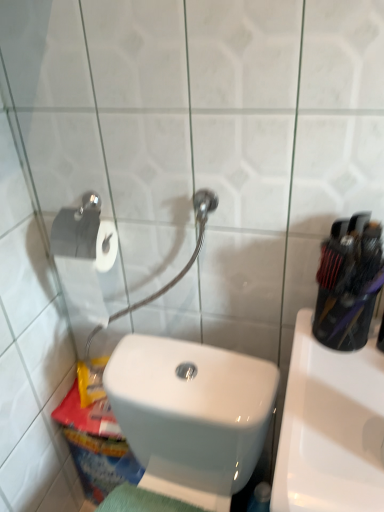
Find the location of a particular element. Image resolution: width=384 pixels, height=512 pixels. white glossy toilet at lower left is located at coordinates (191, 415).

The width and height of the screenshot is (384, 512). Describe the element at coordinates (191, 415) in the screenshot. I see `white glossy toilet at lower left` at that location.

This screenshot has width=384, height=512. What do you see at coordinates (331, 428) in the screenshot?
I see `white glossy sink at right` at bounding box center [331, 428].

Locate an element on the screen. This screenshot has height=512, width=384. white glossy sink at right is located at coordinates (331, 428).

The width and height of the screenshot is (384, 512). I want to click on white glossy toilet at lower left, so click(191, 415).

Is white glossy sink at right to the left or to the right of white glossy toilet at lower left in the image?

In the image, white glossy sink at right appears on the right side of white glossy toilet at lower left.

Between white glossy sink at right and white glossy toilet at lower left, which one is positioned in front?

white glossy toilet at lower left is more forward.

Is point (341, 461) less distant than point (238, 440)?

That is True.

Looking at this image, from the image's perspective, which is below, white glossy sink at right or white glossy toilet at lower left?

From the image's view, white glossy toilet at lower left is below.

From a real-world perspective, is white glossy sink at right above or below white glossy toilet at lower left?

white glossy sink at right is situated lower than white glossy toilet at lower left in the real world.

Is white glossy sink at right thinner than white glossy toilet at lower left?

No.

Which of these two, white glossy sink at right or white glossy toilet at lower left, stands taller?

With more height is white glossy toilet at lower left.

Considering the sizes of objects white glossy sink at right and white glossy toilet at lower left in the image provided, who is smaller, white glossy sink at right or white glossy toilet at lower left?

white glossy sink at right.

Would you say white glossy sink at right contains white glossy toilet at lower left?

No, white glossy toilet at lower left is not inside white glossy sink at right.

Is white glossy sink at right far away from white glossy toilet at lower left?

No, white glossy sink at right is in close proximity to white glossy toilet at lower left.

Is white glossy toilet at lower left at the back of white glossy sink at right?

No.

How many degrees apart are the facing directions of white glossy sink at right and white glossy toilet at lower left?

The angular difference between white glossy sink at right and white glossy toilet at lower left is 1.89 degrees.

Image resolution: width=384 pixels, height=512 pixels. I want to click on sink behind the white glossy toilet at lower left, so click(x=331, y=428).

In the image, is white glossy toilet at lower left on the left side or the right side of white glossy sink at right?

white glossy toilet at lower left is positioned on white glossy sink at right's left side.

Which object is more forward, white glossy toilet at lower left or white glossy sink at right?

Positioned in front is white glossy toilet at lower left.

Does point (134, 432) come behind point (351, 476)?

Yes, point (134, 432) is farther from viewer.

From the image's perspective, between white glossy toilet at lower left and white glossy sink at right, which one is located above?

white glossy sink at right, from the image's perspective.

From a real-world perspective, is white glossy toilet at lower left above or below white glossy sink at right?

→ From a real-world perspective, white glossy toilet at lower left is physically above white glossy sink at right.

Is white glossy toilet at lower left wider or thinner than white glossy sink at right?

In the image, white glossy toilet at lower left appears to be more narrow than white glossy sink at right.

Which of these two, white glossy toilet at lower left or white glossy sink at right, stands taller?

With more height is white glossy toilet at lower left.

Which of these two, white glossy toilet at lower left or white glossy sink at right, is bigger?

With larger size is white glossy toilet at lower left.

Would you say white glossy toilet at lower left is outside white glossy sink at right?

Indeed, white glossy toilet at lower left is completely outside white glossy sink at right.

Is white glossy toilet at lower left in contact with white glossy sink at right?

white glossy toilet at lower left and white glossy sink at right are not in contact.

Could you tell me if white glossy toilet at lower left is turned towards white glossy sink at right?

No, white glossy toilet at lower left is not oriented towards white glossy sink at right.

How many degrees apart are the facing directions of white glossy toilet at lower left and white glossy sink at right?

1.89 degrees separate the facing orientations of white glossy toilet at lower left and white glossy sink at right.

Where is `toilet that appears below the white glossy sink at right (from the image's perspective)`? Image resolution: width=384 pixels, height=512 pixels. toilet that appears below the white glossy sink at right (from the image's perspective) is located at coordinates (191, 415).

Locate an element on the screen. This screenshot has height=512, width=384. toilet that appears in front of the white glossy sink at right is located at coordinates (191, 415).

In the image, there is a white glossy toilet at lower left. Where is `sink above it (from the image's perspective)`? sink above it (from the image's perspective) is located at coordinates (331, 428).